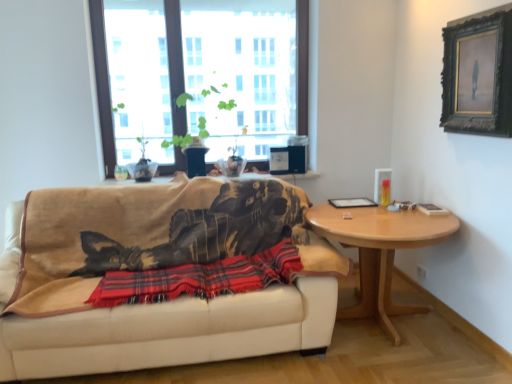
What is the approximate width of green matte plant at upper center?

It is 20.49 inches.

The image size is (512, 384). What are the coordinates of `beige fabric couch at center` in the screenshot? It's located at [136, 305].

Describe the element at coordinates (478, 76) in the screenshot. The width and height of the screenshot is (512, 384). I see `black wooden picture frame at upper right` at that location.

This screenshot has width=512, height=384. Identify the location of light brown wooden table at right. (379, 252).

Locate an element on the screen. The width and height of the screenshot is (512, 384). window behind the red plaid blanket at center is located at coordinates (199, 76).

Looking at the image, does red plaid blanket at center seem bigger or smaller compared to transparent glass window at upper center?

Clearly, red plaid blanket at center is smaller in size than transparent glass window at upper center.

From the picture: How distant is red plaid blanket at center from transparent glass window at upper center?

red plaid blanket at center and transparent glass window at upper center are 1.48 meters apart from each other.

Is red plaid blanket at center completely or partially outside of transparent glass window at upper center?

red plaid blanket at center is positioned outside transparent glass window at upper center.

From a real-world perspective, which object rests below the other?

In real-world perspective, red plaid blanket at center is lower.

From the image's perspective, is transparent glass window at upper center on red plaid blanket at center?

Yes, from the image's perspective, transparent glass window at upper center is on top of red plaid blanket at center.

Between transparent glass window at upper center and red plaid blanket at center, which one has smaller width?

Thinner between the two is transparent glass window at upper center.

Is black wooden picture frame at upper right inside the boundaries of transparent glass window at upper center, or outside?

black wooden picture frame at upper right cannot be found inside transparent glass window at upper center.

Can you confirm if black wooden picture frame at upper right is bigger than transparent glass window at upper center?

Incorrect, black wooden picture frame at upper right is not larger than transparent glass window at upper center.

Would you say black wooden picture frame at upper right is to the left or to the right of transparent glass window at upper center in the picture?

black wooden picture frame at upper right is positioned on transparent glass window at upper center's right side.

Find the location of `window on the left side of black wooden picture frame at upper right`. window on the left side of black wooden picture frame at upper right is located at coordinates (199, 76).

Considering the sizes of objects green matte plant at upper center and beige fabric couch at center in the image provided, who is shorter, green matte plant at upper center or beige fabric couch at center?

Standing shorter between the two is green matte plant at upper center.

Relative to beige fabric couch at center, is green matte plant at upper center in front or behind?

green matte plant at upper center is behind beige fabric couch at center.

In the scene shown: From a real-world perspective, between green matte plant at upper center and beige fabric couch at center, who is vertically higher?

From a 3D spatial view, green matte plant at upper center is above.

Is transparent glass window at upper center positioned with its back to beige fabric couch at center?

That's not correct — transparent glass window at upper center is not looking away from beige fabric couch at center.

Which object is further away from the camera, transparent glass window at upper center or beige fabric couch at center?

Positioned behind is transparent glass window at upper center.

From a real-world perspective, is transparent glass window at upper center physically above beige fabric couch at center?

Indeed, from a real-world perspective, transparent glass window at upper center stands above beige fabric couch at center.

What's the angular difference between transparent glass window at upper center and beige fabric couch at center's facing directions?

They differ by 0.262 degrees in their facing directions.

In terms of size, does light brown wooden table at right appear bigger or smaller than red plaid blanket at center?

In the image, light brown wooden table at right appears to be larger than red plaid blanket at center.

Could you tell me if light brown wooden table at right is facing red plaid blanket at center?

No, light brown wooden table at right is not facing towards red plaid blanket at center.

Locate an element on the screen. The image size is (512, 384). coffee table below the red plaid blanket at center (from the image's perspective) is located at coordinates (379, 252).

How different are the orientations of light brown wooden table at right and red plaid blanket at center in degrees?

The angle between the facing direction of light brown wooden table at right and the facing direction of red plaid blanket at center is 1.21 degrees.

Which object is positioned more to the right, light brown wooden table at right or black wooden picture frame at upper right?

black wooden picture frame at upper right is more to the right.

Does light brown wooden table at right have a lesser width compared to black wooden picture frame at upper right?

No, light brown wooden table at right is not thinner than black wooden picture frame at upper right.

From a real-world perspective, is light brown wooden table at right under black wooden picture frame at upper right?

Indeed, from a real-world perspective, light brown wooden table at right is positioned beneath black wooden picture frame at upper right.

From the image's perspective, is light brown wooden table at right located beneath black wooden picture frame at upper right?

Yes.

Where is `plaid located on the right of transparent glass window at upper center`? This screenshot has height=384, width=512. plaid located on the right of transparent glass window at upper center is located at coordinates (199, 278).

The height and width of the screenshot is (384, 512). I want to click on window that is above the red plaid blanket at center (from a real-world perspective), so click(x=199, y=76).

Which object lies further to the anchor point beige fabric couch at center, light brown wooden table at right or green matte plant at upper center?

The object further to beige fabric couch at center is green matte plant at upper center.

Based on the photo, when comparing their distances from red plaid blanket at center, does green matte plant at upper center or black wooden picture frame at upper right seem further?

black wooden picture frame at upper right is positioned further to the anchor red plaid blanket at center.

Which object lies nearer to the anchor point black wooden picture frame at upper right, green matte plant at upper center or light brown wooden table at right?

Among the two, light brown wooden table at right is located nearer to black wooden picture frame at upper right.

Based on their spatial positions, is light brown wooden table at right or beige fabric couch at center closer to green matte plant at upper center?

beige fabric couch at center is closer to green matte plant at upper center.

When comparing their distances from black wooden picture frame at upper right, does transparent glass window at upper center or beige fabric couch at center seem closer?

The object closer to black wooden picture frame at upper right is transparent glass window at upper center.

Considering their positions, is light brown wooden table at right positioned closer to transparent glass window at upper center than red plaid blanket at center?

Based on the image, light brown wooden table at right appears to be nearer to transparent glass window at upper center.

Estimate the real-world distances between objects in this image. Which object is further from red plaid blanket at center, beige fabric couch at center or transparent glass window at upper center?

transparent glass window at upper center.

Considering their positions, is light brown wooden table at right positioned further to beige fabric couch at center than black wooden picture frame at upper right?

Based on the image, black wooden picture frame at upper right appears to be further to beige fabric couch at center.

Where is `plaid between transparent glass window at upper center and black wooden picture frame at upper right`? plaid between transparent glass window at upper center and black wooden picture frame at upper right is located at coordinates (199, 278).

Where is `studio couch between green matte plant at upper center and red plaid blanket at center from top to bottom`? The image size is (512, 384). studio couch between green matte plant at upper center and red plaid blanket at center from top to bottom is located at coordinates (136, 305).

Identify the location of studio couch between transparent glass window at upper center and light brown wooden table at right from top to bottom. The height and width of the screenshot is (384, 512). (136, 305).

Identify the location of plant between beige fabric couch at center and light brown wooden table at right from left to right. The height and width of the screenshot is (384, 512). (178, 141).